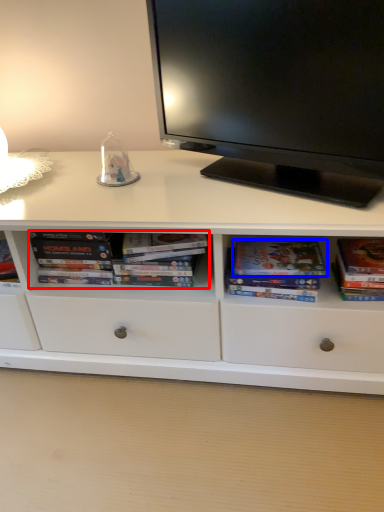
Question: Among these objects, which one is nearest to the camera, book (highlighted by a red box) or paperback book (highlighted by a blue box)?

Choices:
 (A) book
 (B) paperback book

Answer: (B)